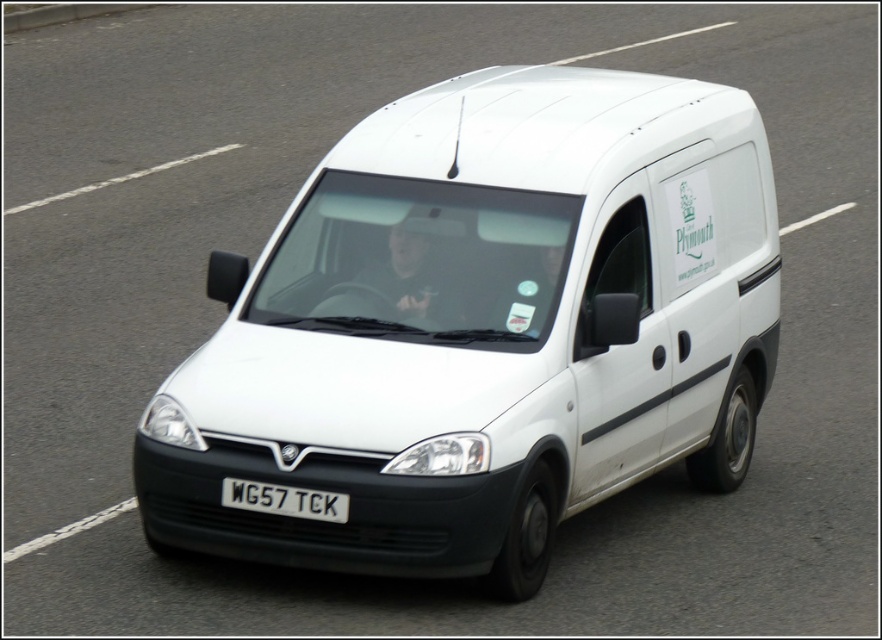
Between white matte van at center and white plastic license plate at center, which one appears on the right side from the viewer's perspective?

white matte van at center is more to the right.

Identify the location of white matte van at center. (482, 326).